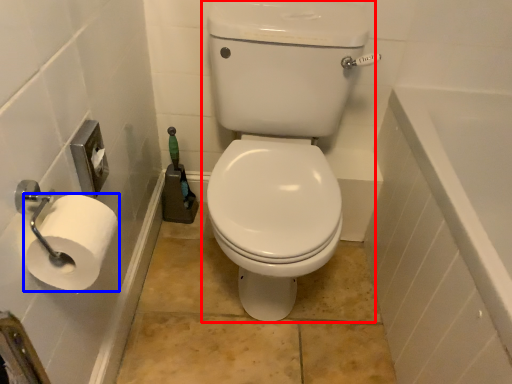
Question: Which of the following is the farthest to the observer, sit (highlighted by a red box) or toilet paper (highlighted by a blue box)?

Choices:
 (A) sit
 (B) toilet paper

Answer: (A)